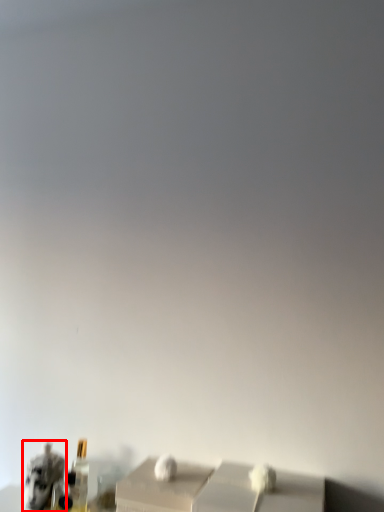
Question: From the image's perspective, what is the correct spatial relationship of animal (annotated by the red box) in relation to bottle?

Choices:
 (A) below
 (B) above

Answer: (A)